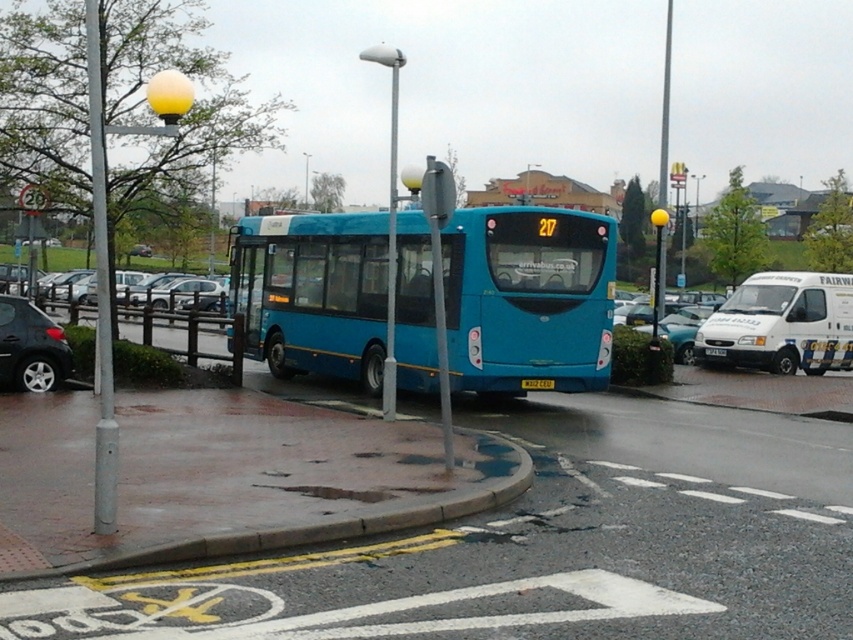
Question: Can you confirm if blue metallic bus at center is smaller than metallic silver car at right?

Choices:
 (A) yes
 (B) no

Answer: (A)

Question: Which of the following is the closest to the observer?

Choices:
 (A) shiny black car at left
 (B) blue metallic bus at center
 (C) metallic silver car at right
 (D) yellow matte license plate at center

Answer: (B)

Question: Can you confirm if silver metallic sedan at center is wider than yellow matte license plate at center?

Choices:
 (A) yes
 (B) no

Answer: (A)

Question: Which is farther from the metallic silver car at right?

Choices:
 (A) yellow matte license plate at center
 (B) shiny black car at left
 (C) silver metallic sedan at center
 (D) yellow plastic license plate at center

Answer: (C)

Question: Among these points, which one is farthest from the camera?

Choices:
 (A) (683, 360)
 (B) (723, 353)

Answer: (A)

Question: Can you confirm if blue metallic bus at center is smaller than shiny black car at left?

Choices:
 (A) yes
 (B) no

Answer: (B)